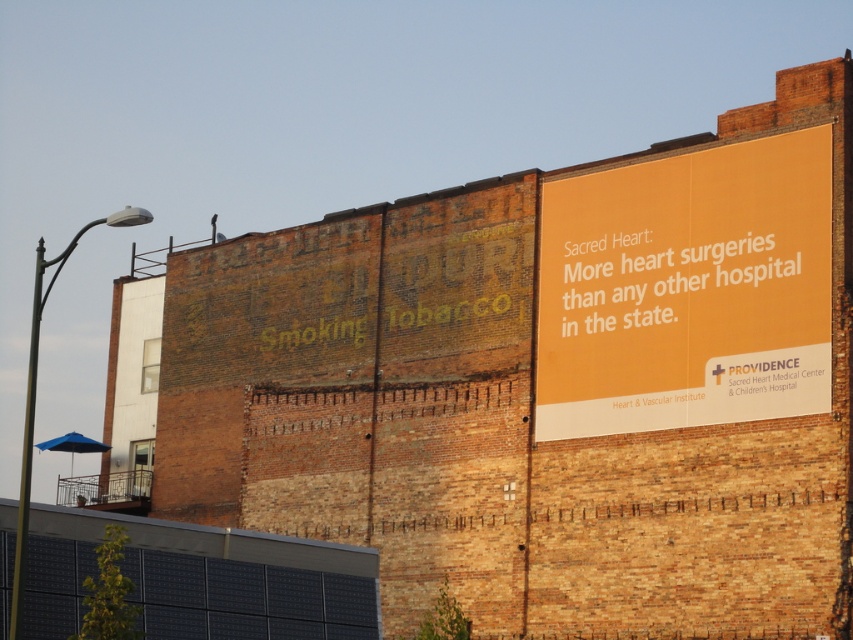
Question: Among these points, which one is nearest to the camera?

Choices:
 (A) (688, 252)
 (B) (651, 259)

Answer: (A)

Question: Is matte orange sign at upper right further to the viewer compared to orange matte sign at upper right?

Choices:
 (A) no
 (B) yes

Answer: (A)

Question: Is matte orange sign at upper right to the left of orange matte sign at upper right from the viewer's perspective?

Choices:
 (A) yes
 (B) no

Answer: (A)

Question: Does matte orange sign at upper right have a lesser width compared to orange matte sign at upper right?

Choices:
 (A) yes
 (B) no

Answer: (B)